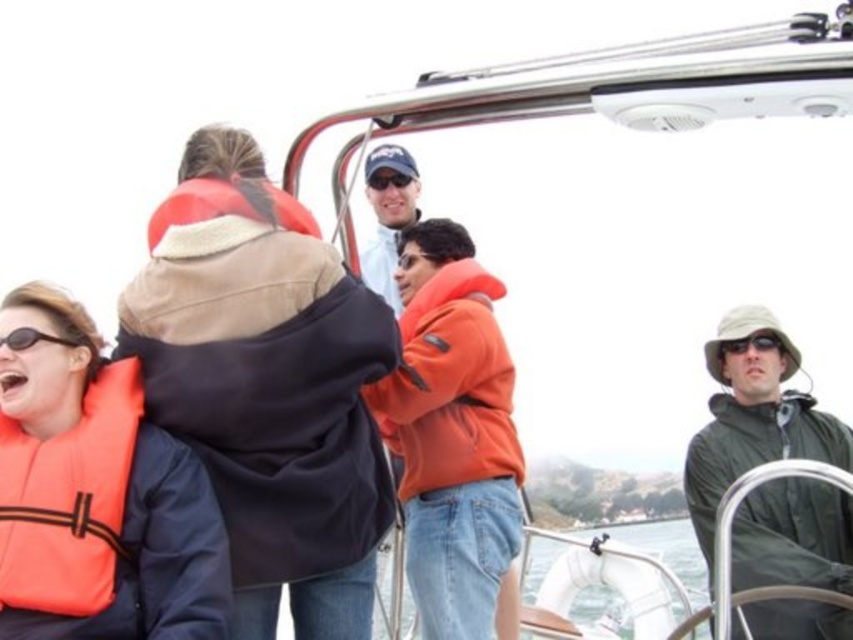
Between point (54, 440) and point (776, 346), which one is positioned behind?

The point (776, 346) is more distant.

Can you confirm if orange life jacket at left is positioned to the right of matte black sunglasses at right?

In fact, orange life jacket at left is to the left of matte black sunglasses at right.

Who is more distant from viewer, (0, 580) or (747, 340)?

The point (747, 340) is behind.

Locate an element on the screen. The height and width of the screenshot is (640, 853). orange life jacket at left is located at coordinates (68, 499).

Which is more to the left, matte black sunglasses at right or black plastic sunglasses at lower left?

Positioned to the left is black plastic sunglasses at lower left.

Does matte black sunglasses at right have a greater width compared to black plastic sunglasses at lower left?

Incorrect, matte black sunglasses at right's width does not surpass black plastic sunglasses at lower left's.

Describe the element at coordinates (752, 342) in the screenshot. I see `matte black sunglasses at right` at that location.

Locate an element on the screen. The height and width of the screenshot is (640, 853). matte black sunglasses at right is located at coordinates (752, 342).

Between matte blue shirt at center and black plastic sunglasses at upper center, which one is positioned lower?

matte blue shirt at center

Find the location of a particular element. This screenshot has width=853, height=640. matte blue shirt at center is located at coordinates (387, 214).

Where is `matte blue shirt at center`? matte blue shirt at center is located at coordinates (387, 214).